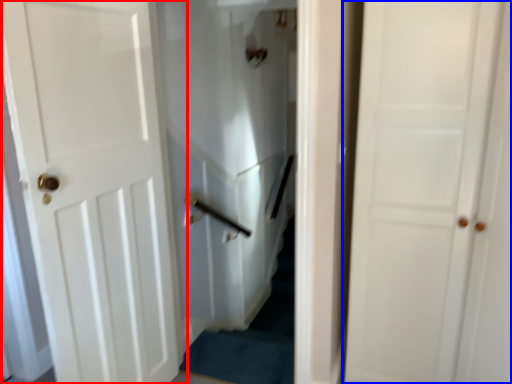
Question: Which point is further to the camera, door (highlighted by a red box) or door (highlighted by a blue box)?

Choices:
 (A) door
 (B) door

Answer: (A)